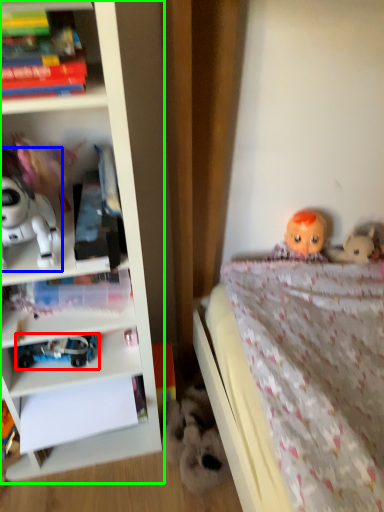
Question: Based on their relative distances, which object is farther from toy (highlighted by a red box)? Choose from toy (highlighted by a blue box) and bookcase (highlighted by a green box).

Choices:
 (A) toy
 (B) bookcase

Answer: (A)